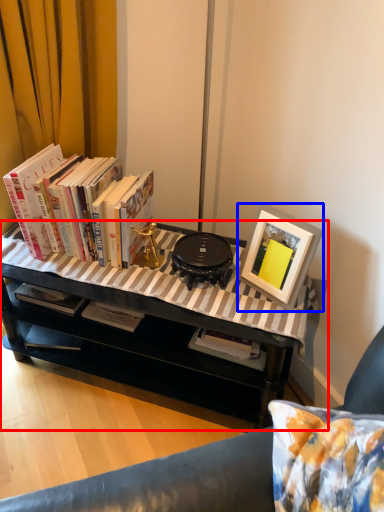
Question: Which object is closer to the camera taking this photo, table (highlighted by a red box) or picture frame (highlighted by a blue box)?

Choices:
 (A) table
 (B) picture frame

Answer: (A)